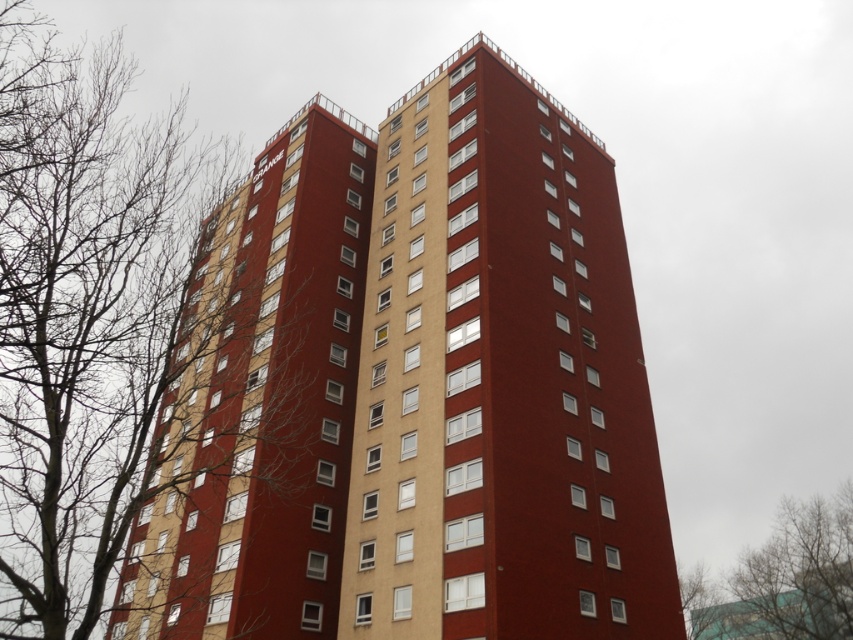
You are standing in a park and see the smooth brick building at center and the bare branches at left. Which one is positioned to the right side?

The smooth brick building at center is positioned to the right of the bare branches at left.

You are a photographer trying to capture the two sets of bare branches in the scene. Which set of branches, the bare branches at left or the bare branches at upper left, would you need to zoom in more to include in your photo?

The bare branches at upper left would require more zoom because they are smaller in width compared to the bare branches at left.

Based on the photo, you are standing in the foreground of the scene and want to take a photo of the two high rise buildings. To frame the photo with the bare branches at left, where should you position the branches in the image?

The bare branches at left are located at point (x=82, y=314), so you should position them at the lower left corner of the image to frame the two high rise buildings.